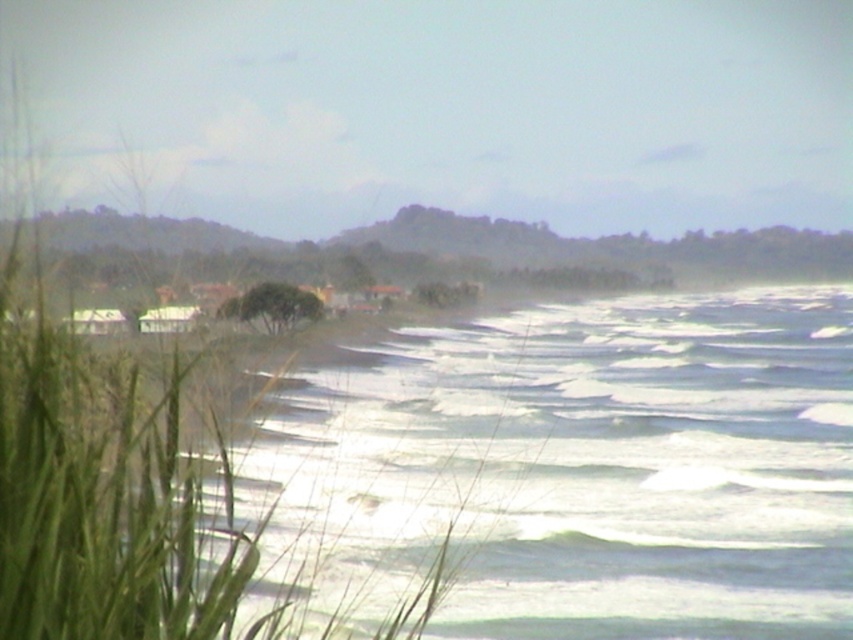
You are standing at the shoreline in the image and want to reach a specific point marked at coordinates point (155, 595). If you walk directly towards it, how far will you have to walk in feet?

The distance of point (155, 595) from viewer is 18.18 feet, so you will have to walk 18.18 feet to reach it.